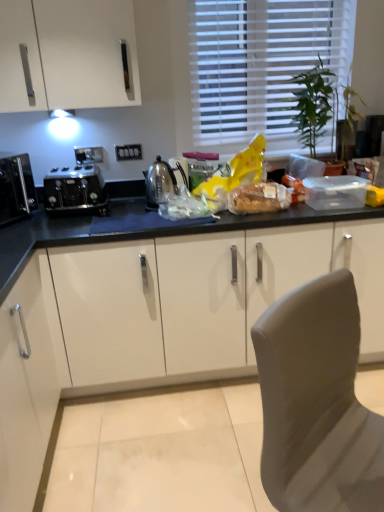
Identify the location of vacant space underneath white blinds at upper center (from a real-world perspective). (274, 148).